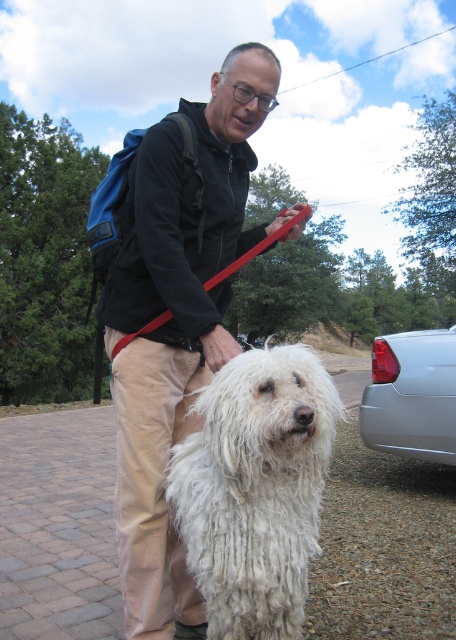
Who is shorter, black matte jacket at center or white fluffy dog at center?

white fluffy dog at center is shorter.

Based on the photo, can you confirm if black matte jacket at center is shorter than white fluffy dog at center?

No.

This screenshot has width=456, height=640. Find the location of `black matte jacket at center`. black matte jacket at center is located at coordinates (176, 317).

Can you confirm if black matte jacket at center is positioned to the left of red rubber leash at center?

Indeed, black matte jacket at center is positioned on the left side of red rubber leash at center.

Between point (140, 218) and point (217, 276), which one is positioned behind?

Point (217, 276)

At what (x,y) coordinates should I click in order to perform the action: click on black matte jacket at center. Please return your answer as a coordinate pair (x, y). Looking at the image, I should click on (176, 317).

This screenshot has width=456, height=640. Describe the element at coordinates (412, 396) in the screenshot. I see `satin silver car at right` at that location.

You are a GUI agent. You are given a task and a screenshot of the screen. Output one action in this format:
    pyautogui.click(x=<x>, y=<y>)
    Task: Click on the satin silver car at right
    
    Given the screenshot: What is the action you would take?
    pyautogui.click(x=412, y=396)

Is point (436, 387) positioned after point (239, 262)?

Yes, it is behind point (239, 262).

Find the location of a particular element. Image resolution: width=456 pixels, height=640 pixels. satin silver car at right is located at coordinates (412, 396).